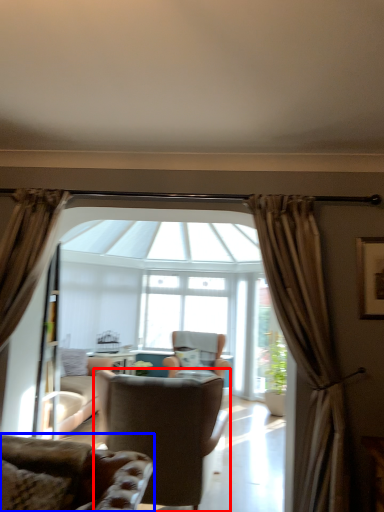
Question: Which object is further to the camera taking this photo, chair (highlighted by a red box) or chair (highlighted by a blue box)?

Choices:
 (A) chair
 (B) chair

Answer: (A)